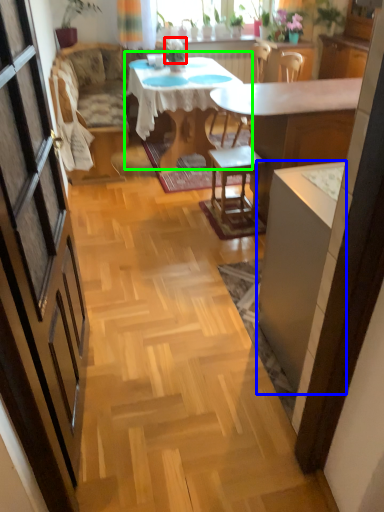
Question: Estimate the real-world distances between objects in this image. Which object is closer to plant (highlighted by a red box), cabinetry (highlighted by a blue box) or kitchen & dining room table (highlighted by a green box)?

Choices:
 (A) cabinetry
 (B) kitchen & dining room table

Answer: (B)